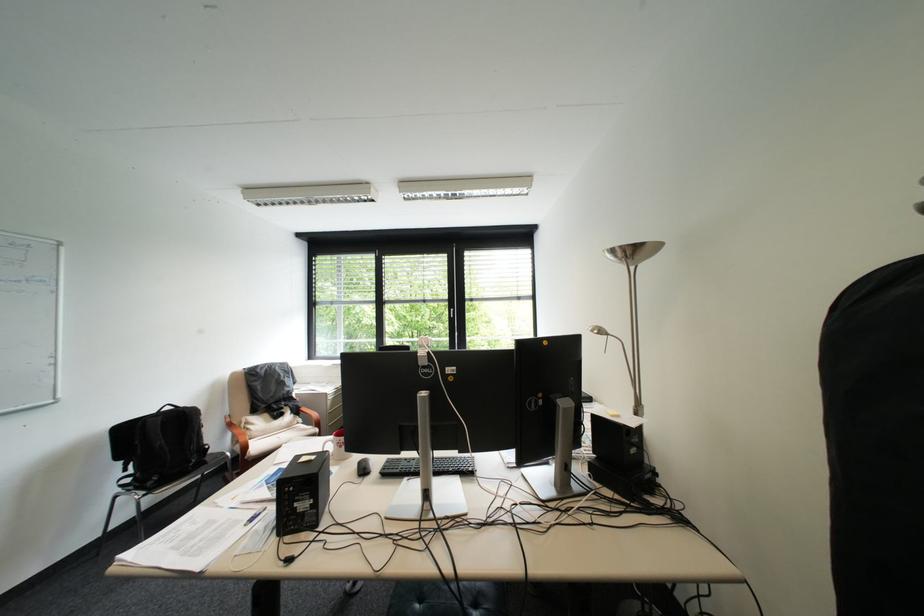
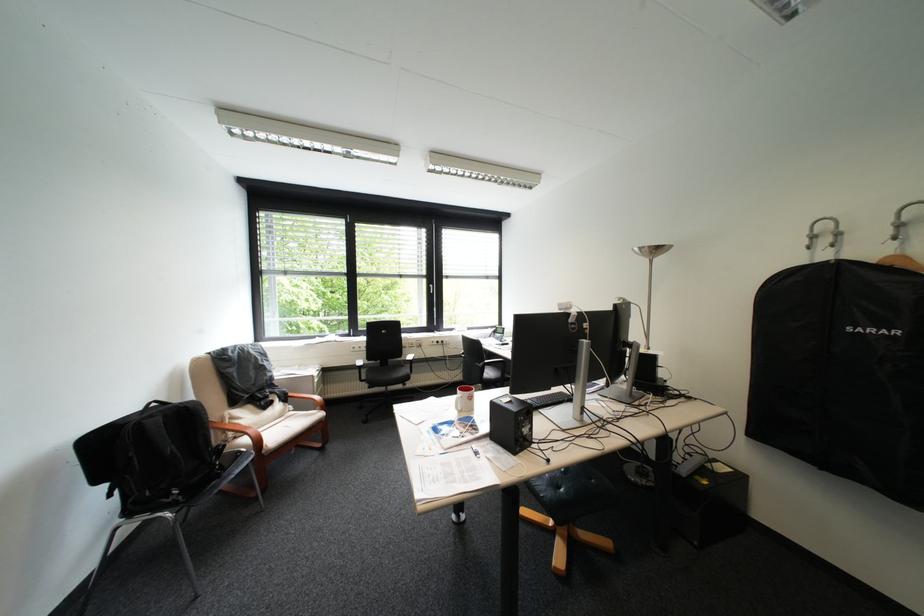
Locate, in the second image, the point that corresponds to [270,503] in the first image.

(469, 446)